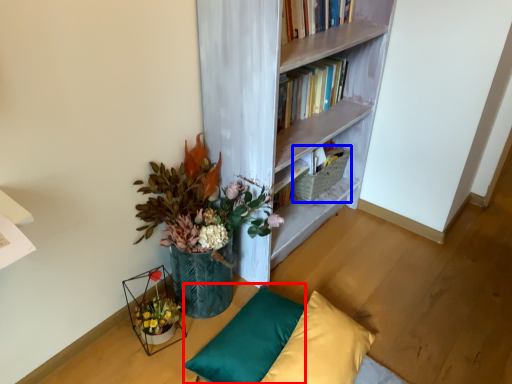
Question: Which object is closer to the camera taking this photo, pillow (highlighted by a red box) or basket (highlighted by a blue box)?

Choices:
 (A) pillow
 (B) basket

Answer: (A)